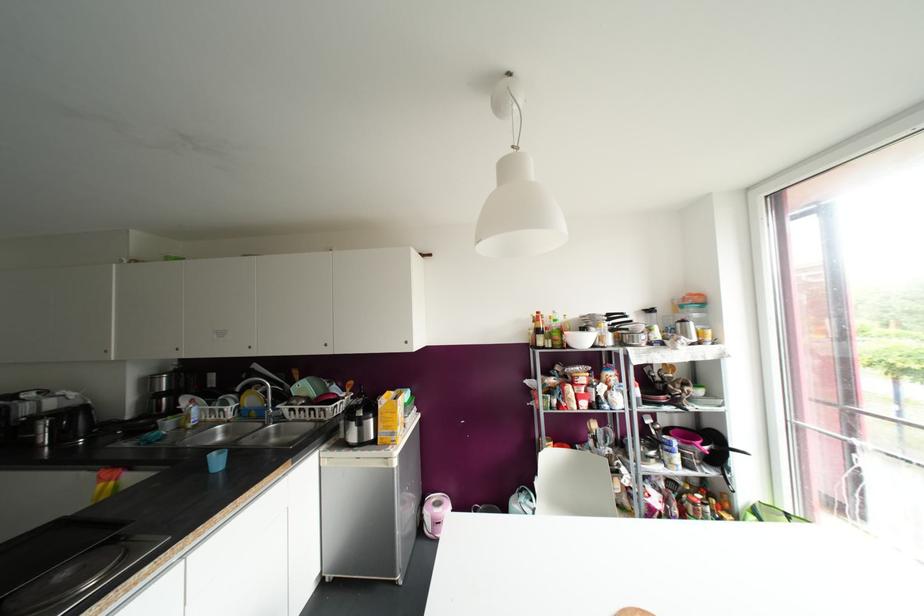
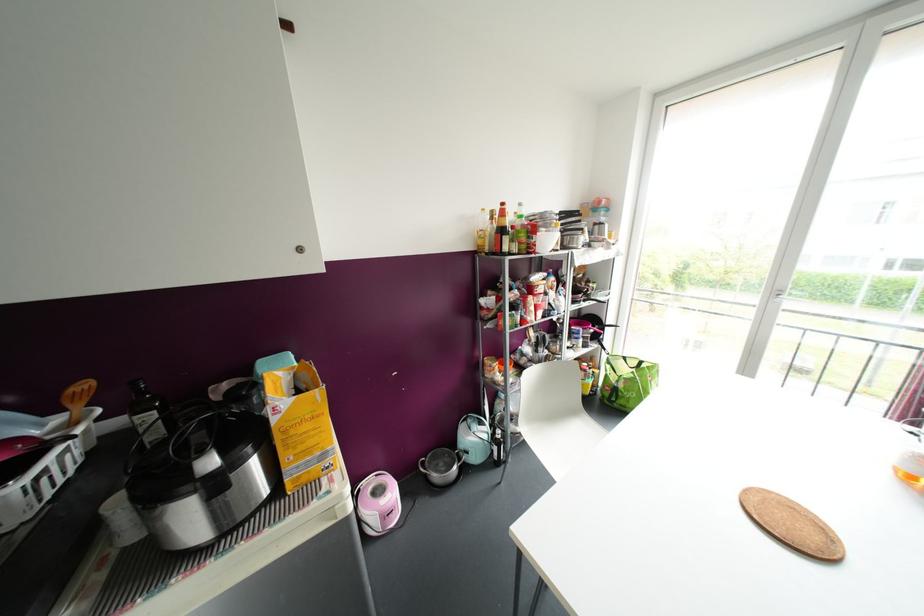
In the second image, find the point that corresponds to (x=537, y=312) in the first image.

(502, 204)